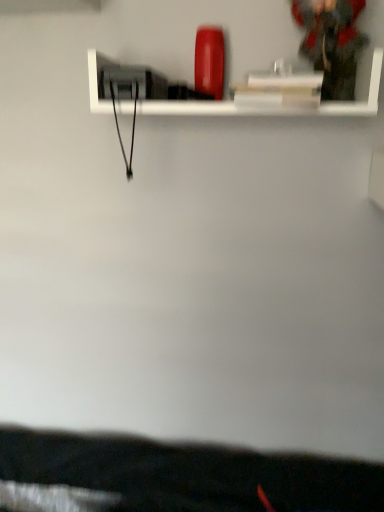
Question: Does white glossy shelf at upper center come in front of dark gray fabric jacket at upper right?

Choices:
 (A) no
 (B) yes

Answer: (B)

Question: Could you tell me if white glossy shelf at upper center is facing dark gray fabric jacket at upper right?

Choices:
 (A) no
 (B) yes

Answer: (A)

Question: Can you confirm if white glossy shelf at upper center is smaller than dark gray fabric jacket at upper right?

Choices:
 (A) yes
 (B) no

Answer: (B)

Question: From a real-world perspective, is white glossy shelf at upper center on top of dark gray fabric jacket at upper right?

Choices:
 (A) yes
 (B) no

Answer: (B)

Question: From a real-world perspective, is white glossy shelf at upper center positioned under dark gray fabric jacket at upper right based on gravity?

Choices:
 (A) no
 (B) yes

Answer: (B)

Question: Can you confirm if white glossy shelf at upper center is shorter than dark gray fabric jacket at upper right?

Choices:
 (A) yes
 (B) no

Answer: (A)

Question: Considering the relative sizes of dark gray fabric jacket at upper right and white glossy shelf at upper center in the image provided, is dark gray fabric jacket at upper right thinner than white glossy shelf at upper center?

Choices:
 (A) yes
 (B) no

Answer: (A)

Question: Does dark gray fabric jacket at upper right lie in front of white glossy shelf at upper center?

Choices:
 (A) yes
 (B) no

Answer: (B)

Question: Does dark gray fabric jacket at upper right have a larger size compared to white glossy shelf at upper center?

Choices:
 (A) yes
 (B) no

Answer: (B)

Question: From a real-world perspective, is dark gray fabric jacket at upper right located higher than white glossy shelf at upper center?

Choices:
 (A) yes
 (B) no

Answer: (A)

Question: From the image's perspective, is dark gray fabric jacket at upper right under white glossy shelf at upper center?

Choices:
 (A) yes
 (B) no

Answer: (B)

Question: Is dark gray fabric jacket at upper right not near white glossy shelf at upper center?

Choices:
 (A) no
 (B) yes

Answer: (A)

Question: Considering the positions of white glossy shelf at upper center and dark gray fabric jacket at upper right in the image, is white glossy shelf at upper center wider or thinner than dark gray fabric jacket at upper right?

Choices:
 (A) wide
 (B) thin

Answer: (A)